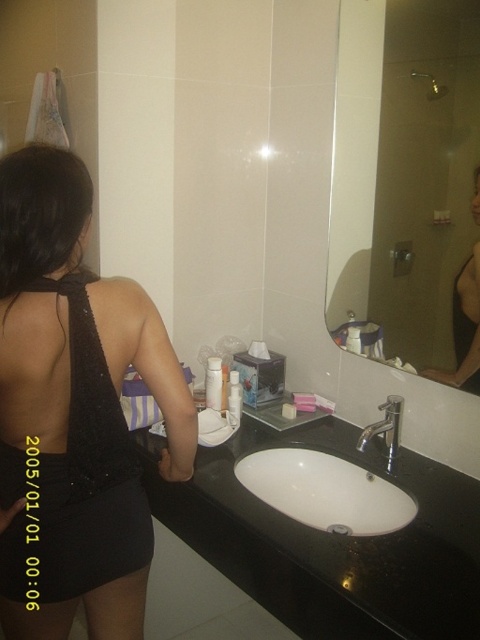
You are a person standing in the bathroom and want to wash your hands. Which object should you approach first, the glossy glass mirror at upper right or the white glossy sink at center?

You should approach the white glossy sink at center first because the glossy glass mirror at upper right is further away from you than the white glossy sink at center.